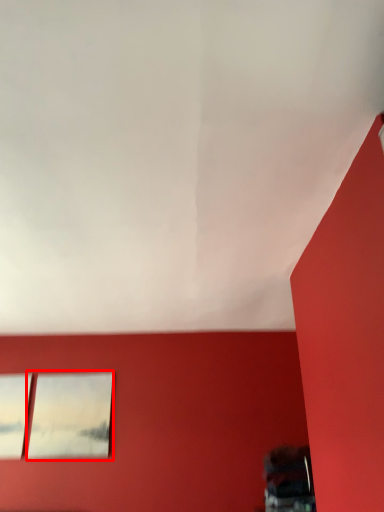
Question: Where is picture frame (annotated by the red box) located in relation to window in the image?

Choices:
 (A) left
 (B) right

Answer: (B)